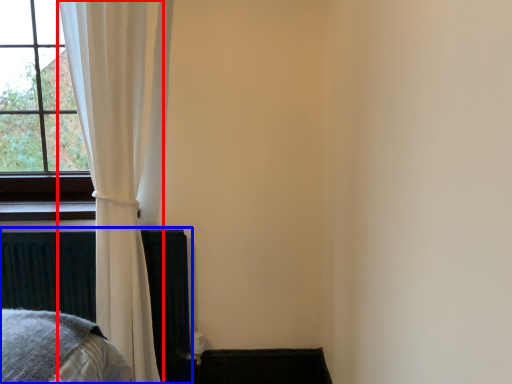
Question: Which of the following is the farthest to the observer, curtain (highlighted by a red box) or bed frame (highlighted by a blue box)?

Choices:
 (A) curtain
 (B) bed frame

Answer: (B)